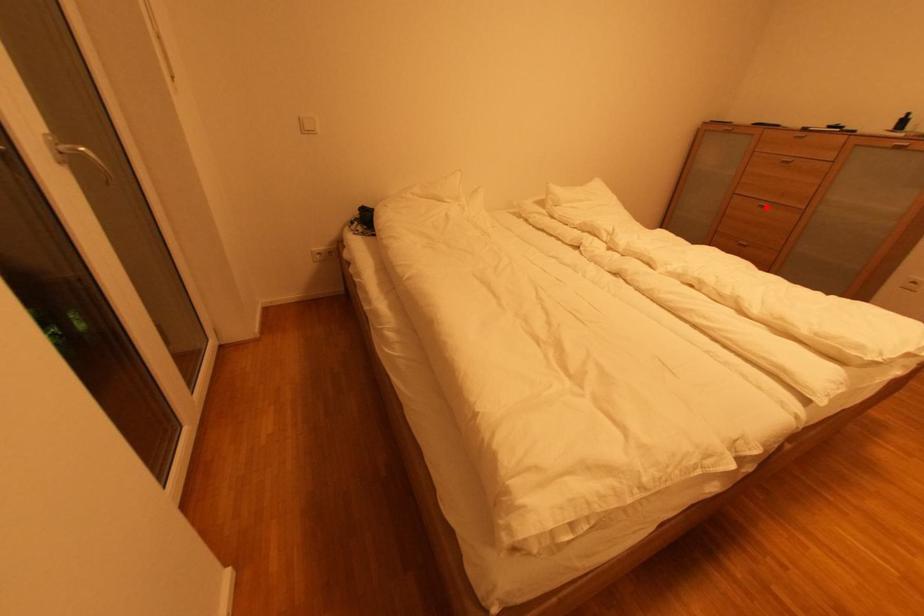
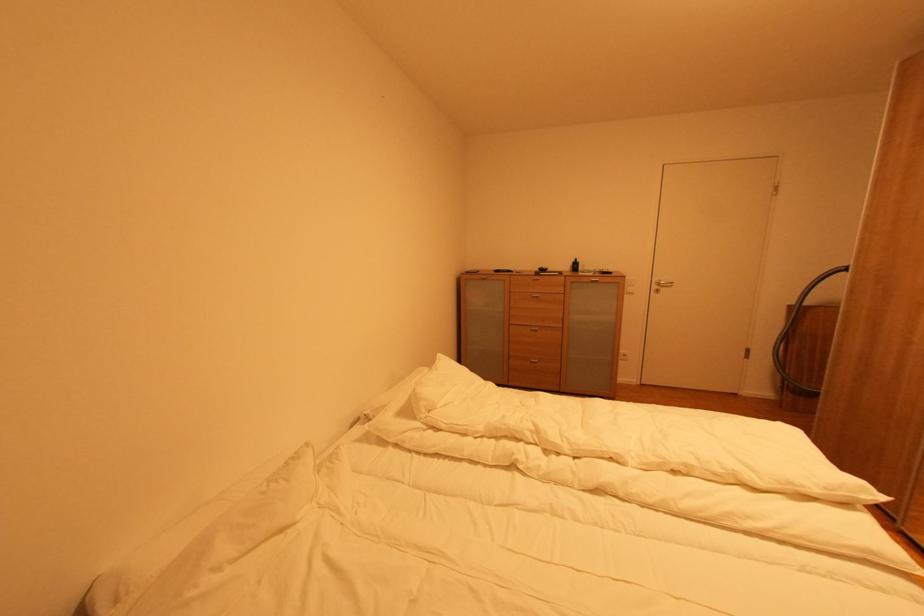
Locate, in the second image, the point that corresponds to the highlighted location in the first image.

(539, 331)